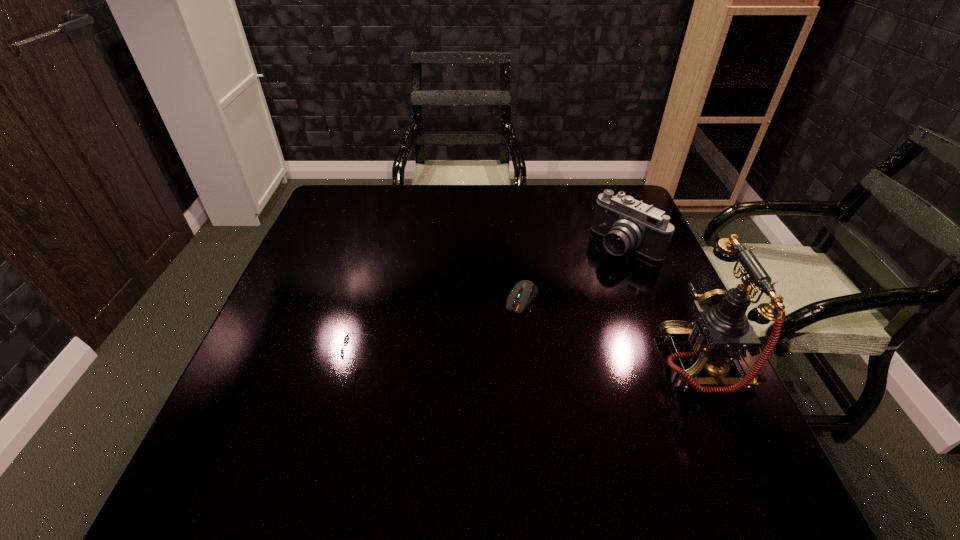
Locate an element on the screen. The width and height of the screenshot is (960, 540). vacant area in the image that satisfies the following two spatial constraints: 1. on the front side of the tallest object; 2. on the front of the third nearest object, featuring the rotary dial is located at coordinates (528, 362).